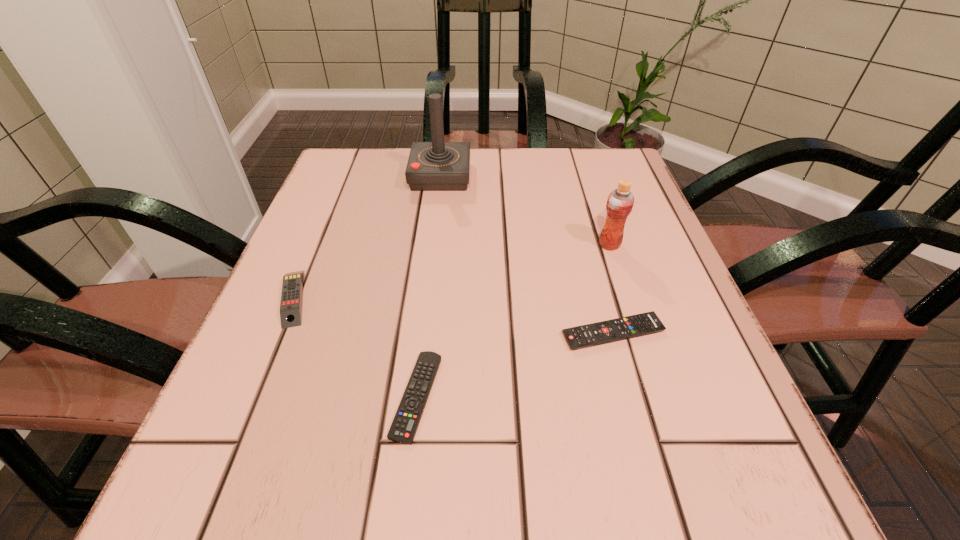
Where is `vacant space at the near edge of the desktop`? vacant space at the near edge of the desktop is located at coordinates (406, 509).

Find the location of a particular element. The height and width of the screenshot is (540, 960). free space at the left edge of the desktop is located at coordinates (367, 252).

The image size is (960, 540). Find the location of `free space at the right edge of the desktop`. free space at the right edge of the desktop is located at coordinates (664, 270).

This screenshot has width=960, height=540. I want to click on blank space at the far left corner of the desktop, so click(376, 171).

At what (x,y) coordinates should I click in order to perform the action: click on vacant point at the near left corner. Please return your answer as a coordinate pair (x, y). The image size is (960, 540). Looking at the image, I should click on (228, 475).

Locate an element on the screen. free spot between the fourth nearest object and the second shortest remote control is located at coordinates (612, 289).

I want to click on vacant point located between the second remote control from left to right and the second shortest remote control, so click(515, 364).

At what (x,y) coordinates should I click in order to perform the action: click on free spot between the orange juice and the second shortest remote control. Please return your answer as a coordinate pair (x, y). This screenshot has height=540, width=960. Looking at the image, I should click on (612, 289).

The image size is (960, 540). Identify the location of free space between the leftmost remote control and the fourth nearest object. (451, 271).

Locate an element on the screen. vacant area that lies between the leftmost remote control and the orange juice is located at coordinates (451, 271).